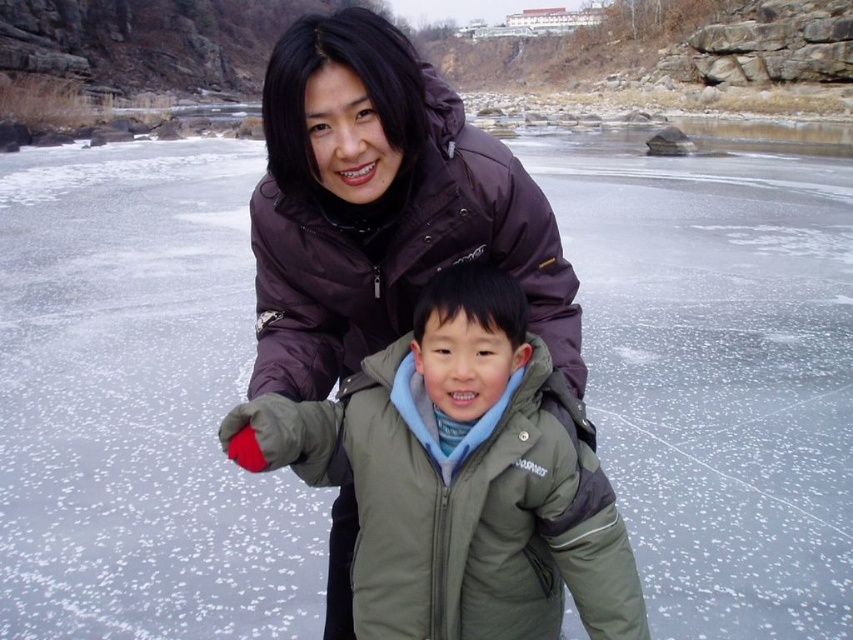
Question: Which point is farther from the camera taking this photo?

Choices:
 (A) (360, 339)
 (B) (519, 364)

Answer: (A)

Question: Does green fuzzy jacket at center have a greater width compared to dark purple down jacket at center?

Choices:
 (A) yes
 (B) no

Answer: (A)

Question: Which point is farther to the camera?

Choices:
 (A) (456, 586)
 (B) (573, 321)

Answer: (B)

Question: Is green fuzzy jacket at center positioned before dark purple down jacket at center?

Choices:
 (A) yes
 (B) no

Answer: (A)

Question: Is green fuzzy jacket at center to the left of dark purple down jacket at center from the viewer's perspective?

Choices:
 (A) yes
 (B) no

Answer: (B)